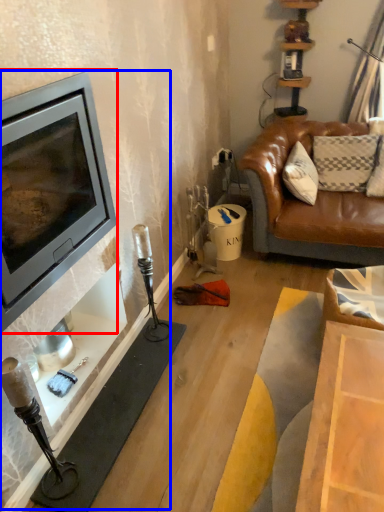
Question: Which point is further to the camera, wood burning stove (highlighted by a red box) or fireplace (highlighted by a blue box)?

Choices:
 (A) wood burning stove
 (B) fireplace

Answer: (B)